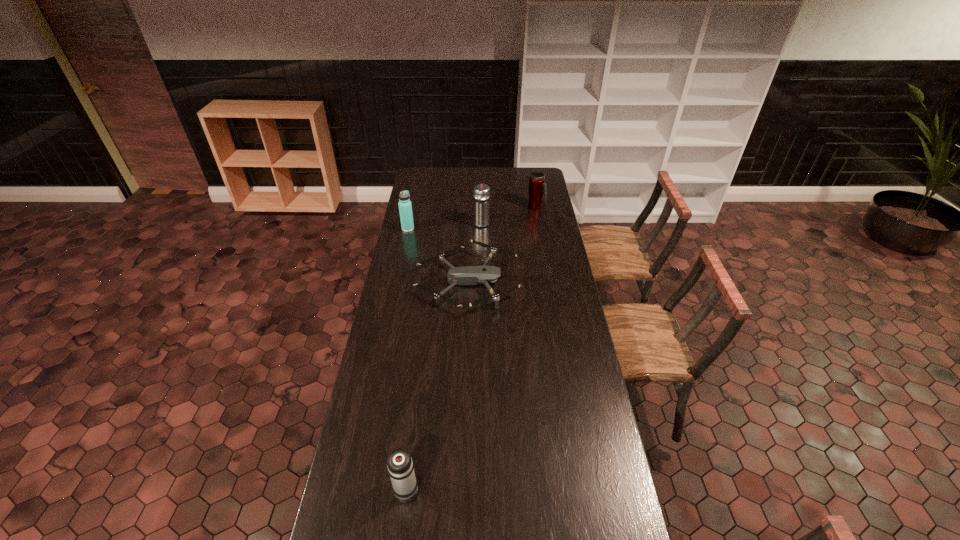
I want to click on the second thermos bottle from right to left, so click(481, 193).

Locate an element on the screen. The height and width of the screenshot is (540, 960). the leftmost thermos bottle is located at coordinates (405, 208).

Locate an element on the screen. This screenshot has width=960, height=540. the farthest object is located at coordinates (537, 186).

Find the location of a particular element. The image size is (960, 540). the rightmost thermos bottle is located at coordinates (537, 186).

This screenshot has width=960, height=540. Identify the location of the shortest thermos bottle. (400, 466).

The image size is (960, 540). Find the location of `the nearest object`. the nearest object is located at coordinates (400, 466).

The width and height of the screenshot is (960, 540). I want to click on the shortest object, so click(466, 275).

I want to click on the fourth farthest object, so click(466, 275).

Identify the location of free space located with a handle on the side of the second thermos bottle from right to left. This screenshot has height=540, width=960. (482, 202).

The height and width of the screenshot is (540, 960). I want to click on free space located with a handle on the side of the second thermos bottle from right to left, so click(x=481, y=188).